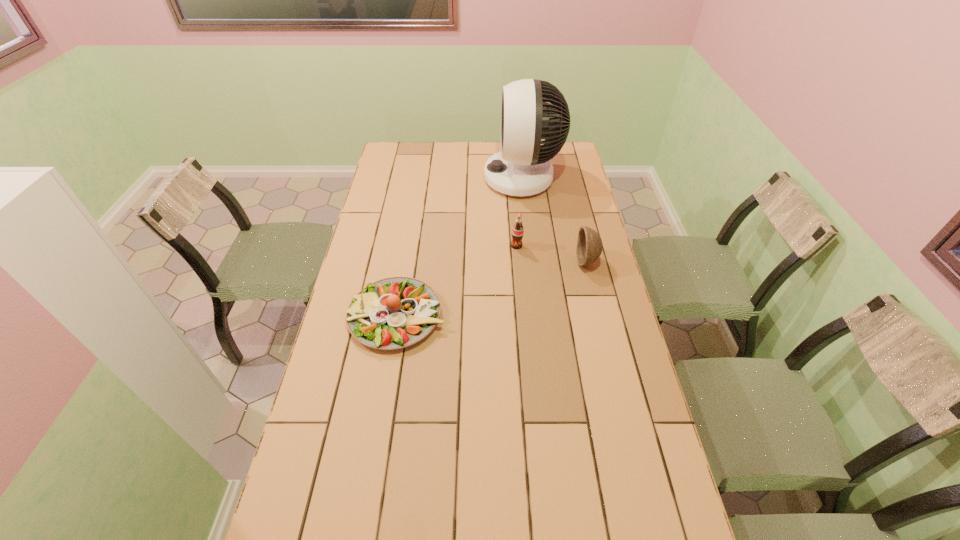
Image resolution: width=960 pixels, height=540 pixels. What are the coordinates of `vacant space located on the left of the bowl` in the screenshot? It's located at (512, 261).

Where is `free point located on the right of the salad plate`? free point located on the right of the salad plate is located at coordinates (523, 316).

Locate an element on the screen. This screenshot has height=540, width=960. object that is positioned at the far edge is located at coordinates (522, 168).

Image resolution: width=960 pixels, height=540 pixels. I want to click on object at the left edge, so click(x=393, y=313).

Find the location of a particular element. fan positioned at the right edge is located at coordinates (522, 168).

The image size is (960, 540). I want to click on bowl at the right edge, so click(589, 244).

Where is `object at the far right corner`? The image size is (960, 540). object at the far right corner is located at coordinates (522, 168).

Where is `vacant area at the far edge`? The height and width of the screenshot is (540, 960). vacant area at the far edge is located at coordinates (468, 163).

You are a GUI agent. You are given a task and a screenshot of the screen. Output one action in this format:
    pyautogui.click(x=<x>, y=<y>)
    Task: Click on the free space at the left edge of the desktop
    The height and width of the screenshot is (540, 960).
    Given the screenshot: What is the action you would take?
    pos(383,255)

In the image, there is a desktop. Identify the location of vacant space at the right edge. This screenshot has width=960, height=540. (633, 457).